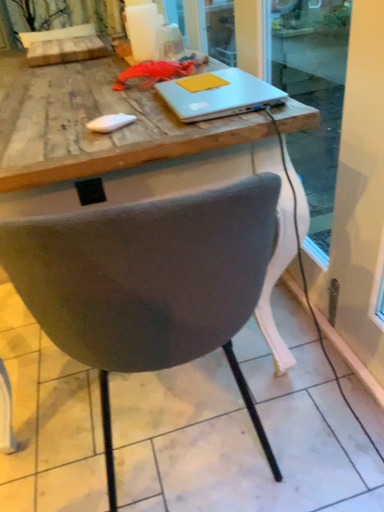
Where is `vacant region below gray fabric chair at center (from a real-world perspective)`? vacant region below gray fabric chair at center (from a real-world perspective) is located at coordinates (176, 426).